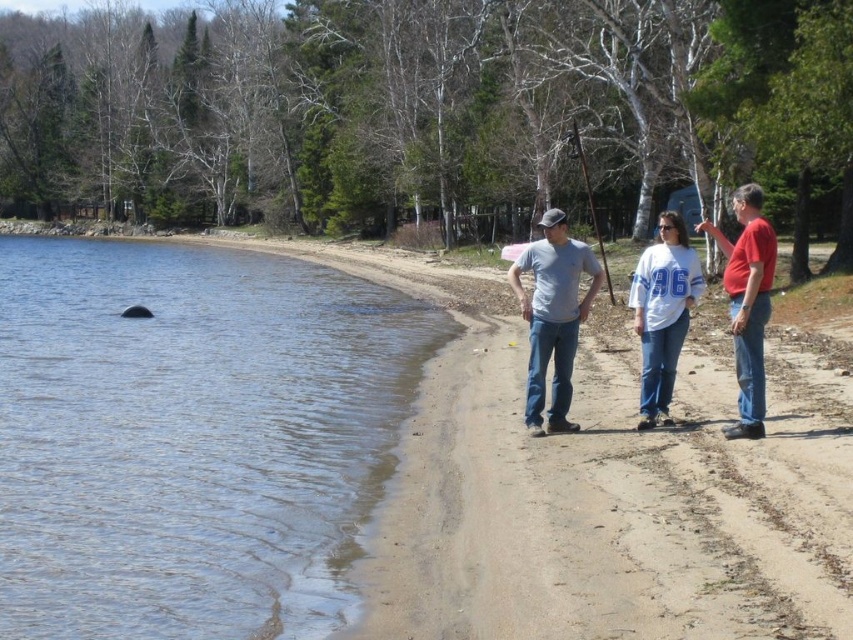
Is point (379, 474) in front of point (749, 202)?

No.

Does clear water at shore left have a greater height compared to red cotton shirt at right?

Incorrect, clear water at shore left's height is not larger of red cotton shirt at right's.

Which is in front, point (386, 477) or point (747, 397)?

Point (747, 397)

Locate an element on the screen. Image resolution: width=853 pixels, height=640 pixels. clear water at shore left is located at coordinates (192, 436).

Consider the image. Between white jersey at center and red cotton shirt at right, which one has less height?

white jersey at center

Identify the location of white jersey at center. The image size is (853, 640). (662, 314).

Is clear water at shore left to the left of white cotton shirt at center from the viewer's perspective?

Correct, you'll find clear water at shore left to the left of white cotton shirt at center.

Between point (96, 570) and point (665, 248), which one is positioned behind?

Point (665, 248)

Does point (370, 408) come in front of point (683, 241)?

No.

Locate an element on the screen. The height and width of the screenshot is (640, 853). clear water at shore left is located at coordinates (192, 436).